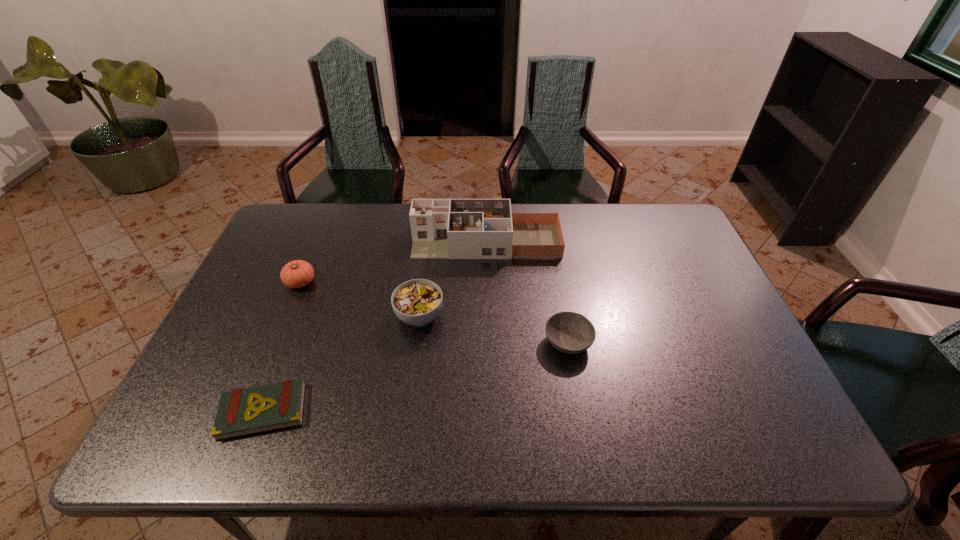
This screenshot has width=960, height=540. I want to click on vacant space at the near edge of the desktop, so click(x=604, y=448).

In the image, there is a desktop. Find the location of `vacant space at the left edge`. vacant space at the left edge is located at coordinates (244, 353).

In the image, there is a desktop. At what (x,y) coordinates should I click in order to perform the action: click on vacant space at the right edge. Please return your answer as a coordinate pair (x, y). This screenshot has height=540, width=960. Looking at the image, I should click on (728, 393).

I want to click on free region at the near left corner, so click(x=225, y=441).

You are a GUI agent. You are given a task and a screenshot of the screen. Output one action in this format:
    pyautogui.click(x=<x>, y=<y>)
    Task: Click on the vacant position at the far right corner of the desktop
    
    Given the screenshot: What is the action you would take?
    pyautogui.click(x=651, y=215)

Locate an element on the screen. empty location between the shortest object and the bowl is located at coordinates (416, 377).

Where is `vacant point located between the nearest object and the bowl`? Image resolution: width=960 pixels, height=540 pixels. vacant point located between the nearest object and the bowl is located at coordinates coord(416,377).

At what (x,y) coordinates should I click in order to perform the action: click on unoccupied area between the bowl and the nearest object. Please return your answer as a coordinate pair (x, y). The height and width of the screenshot is (540, 960). Looking at the image, I should click on (416, 377).

The image size is (960, 540). I want to click on free space between the book and the soup bowl, so click(x=342, y=363).

You are a GUI agent. You are given a task and a screenshot of the screen. Output one action in this format:
    pyautogui.click(x=<x>, y=<y>)
    Task: Click on the free space that is in between the farthest object and the second shortest object
    This screenshot has height=540, width=960.
    Given the screenshot: What is the action you would take?
    pyautogui.click(x=527, y=292)